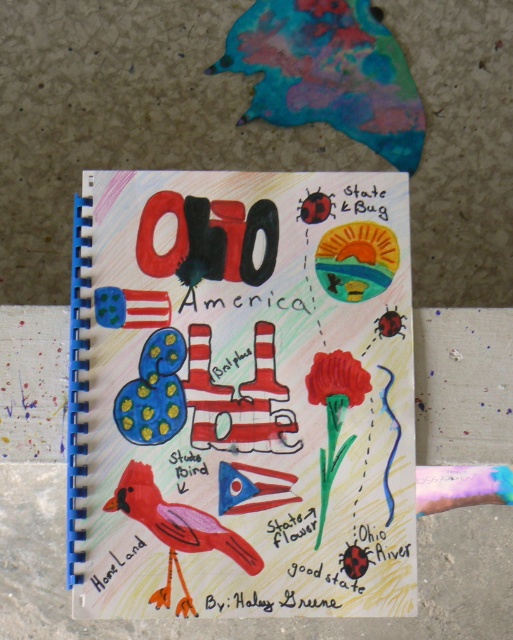
Does smooth pink bird at center appear on the right side of matte red flower at center?

No, smooth pink bird at center is not to the right of matte red flower at center.

Who is taller, smooth pink bird at center or matte red flower at center?

smooth pink bird at center

Locate an element on the screen. Image resolution: width=513 pixels, height=640 pixels. smooth pink bird at center is located at coordinates (176, 531).

Where is `smooth pink bird at center`? The height and width of the screenshot is (640, 513). smooth pink bird at center is located at coordinates (176, 531).

Who is higher up, smooth pink bird at center or white paper at lower left?

Positioned higher is smooth pink bird at center.

Which of these two, smooth pink bird at center or white paper at lower left, stands taller?

Standing taller between the two is smooth pink bird at center.

Locate an element on the screen. smooth pink bird at center is located at coordinates (176, 531).

What are the coordinates of `smooth pink bird at center` in the screenshot? It's located at (176, 531).

Is colored paper notebook at center above smooth pink bird at center?

Indeed, colored paper notebook at center is positioned over smooth pink bird at center.

Who is positioned more to the left, colored paper notebook at center or smooth pink bird at center?

From the viewer's perspective, smooth pink bird at center appears more on the left side.

The image size is (513, 640). What do you see at coordinates (241, 394) in the screenshot? I see `colored paper notebook at center` at bounding box center [241, 394].

Where is `colored paper notebook at center`? colored paper notebook at center is located at coordinates (241, 394).